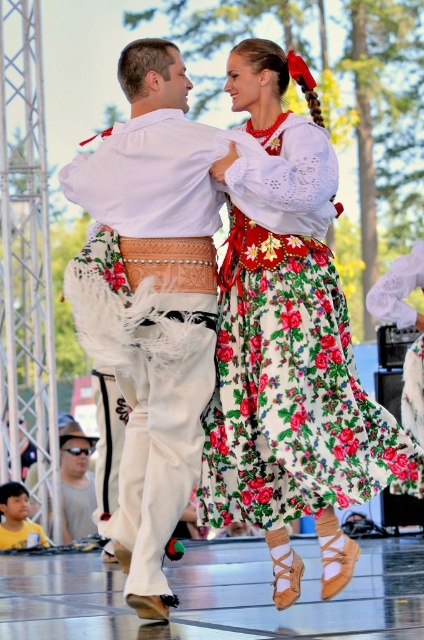
Who is positioned more to the left, floral cotton skirt at center or white leather pants at center?

white leather pants at center

Who is more forward, (248,131) or (180,308)?

Point (180,308) is more forward.

Does point (295, 400) come farther from viewer compared to point (136, 397)?

No, it is in front of (136, 397).

Image resolution: width=424 pixels, height=640 pixels. What are the coordinates of `floral cotton skirt at center` in the screenshot? It's located at (292, 406).